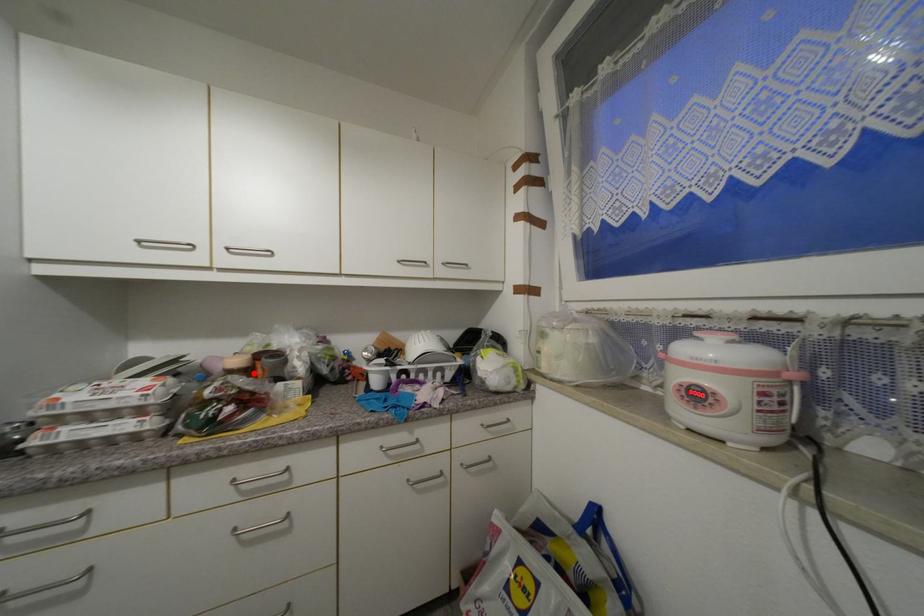
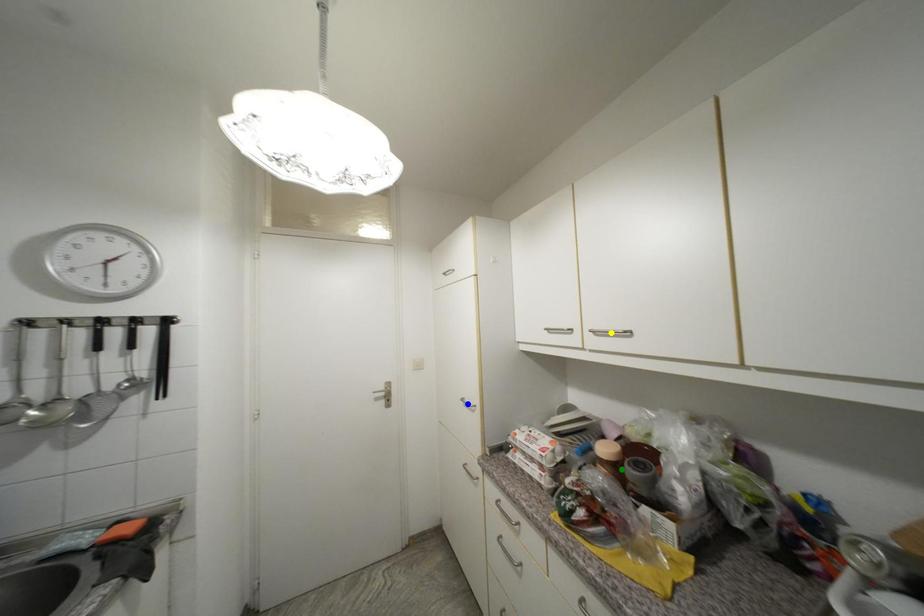
Question: I am providing you with two images of the same scene from different viewpoints. A red point is marked on the first image. You are given multiple points on the second image. Which point in image 2 represents the same 3d spot as the red point in image 1?

Choices:
 (A) yellow point
 (B) green point
 (C) blue point

Answer: (B)